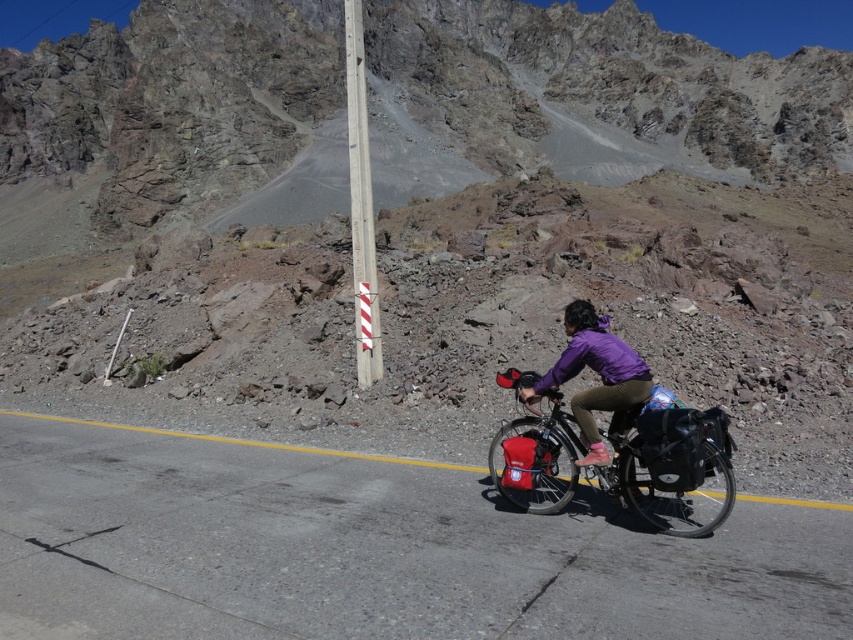
From the picture: You are a hiker planning to take a photo of the purple matte jacket at center and the white striped concrete pole at center. Which object should you focus on first if you want to capture both in a single frame without moving the camera?

You should focus on the white striped concrete pole at center first because it is larger and will require more attention to ensure it fits properly in the frame, allowing the smaller purple matte jacket at center to also be captured.